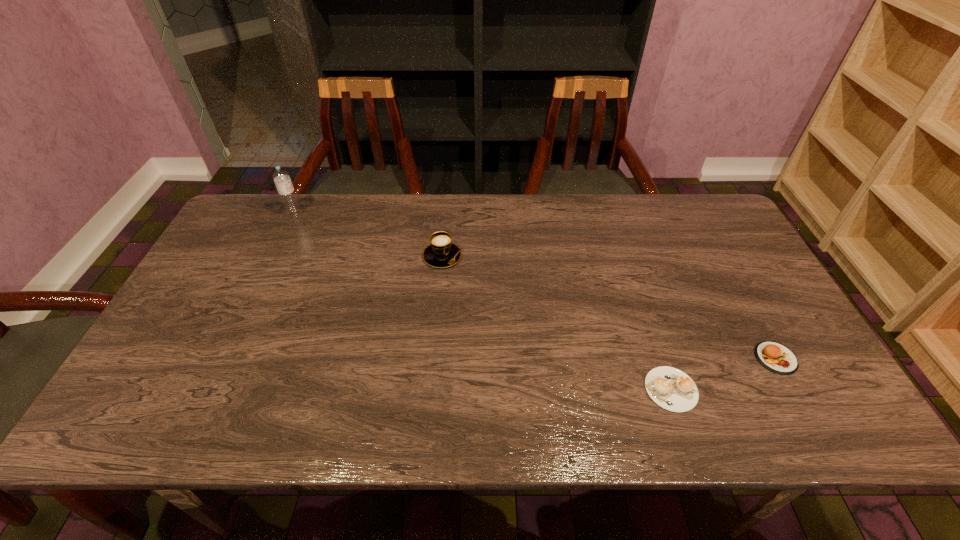
This screenshot has width=960, height=540. Identify the location of free point at the right edge. (744, 334).

In the image, there is a desktop. Where is `free space at the far left corner`? The image size is (960, 540). free space at the far left corner is located at coordinates click(x=271, y=199).

Locate an element on the screen. The image size is (960, 540). vacant area between the water bottle and the second shortest object is located at coordinates (536, 286).

This screenshot has height=540, width=960. What are the coordinates of `vacant space that's between the patty (food) and the left cappuccino` in the screenshot? It's located at (610, 307).

At what (x,y) coordinates should I click in order to perform the action: click on vacant region between the second object from right to left and the rightmost object. Please return your answer as a coordinate pair (x, y). Looking at the image, I should click on (723, 374).

The width and height of the screenshot is (960, 540). Find the location of `blank region between the shortest object and the second shortest object`. blank region between the shortest object and the second shortest object is located at coordinates (723, 374).

Where is `empty location between the second object from right to left and the rightmost object`? The height and width of the screenshot is (540, 960). empty location between the second object from right to left and the rightmost object is located at coordinates (723, 374).

I want to click on free spot between the third object from right to left and the shortest object, so click(x=557, y=323).

I want to click on free space between the farthest object and the rightmost object, so click(536, 286).

I want to click on blank region between the left cappuccino and the right cappuccino, so click(557, 323).